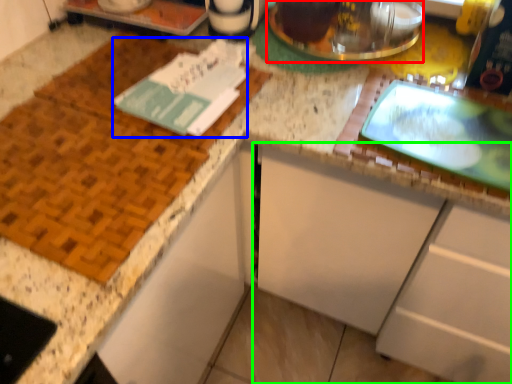
Question: Considering the real-world distances, which object is farthest from appliance (highlighted by a red box)? journal (highlighted by a blue box) or cabinetry (highlighted by a green box)?

Choices:
 (A) journal
 (B) cabinetry

Answer: (B)